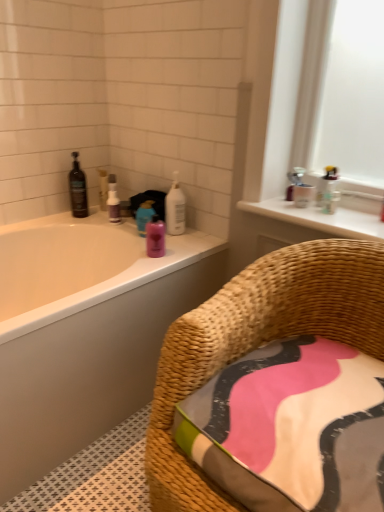
Locate an element on the screen. empty space that is to the right of black glass bottle at upper left is located at coordinates (100, 221).